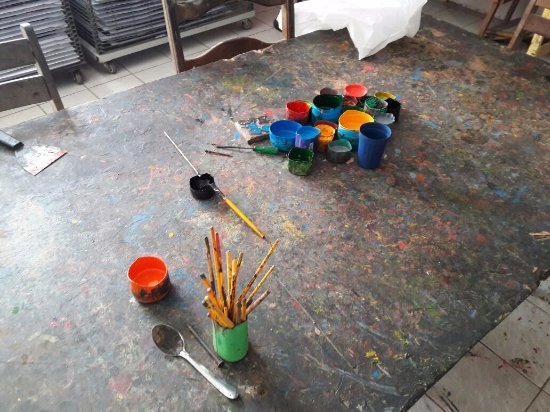
The width and height of the screenshot is (550, 412). Find the location of `cups of paint`. cups of paint is located at coordinates (338, 126).